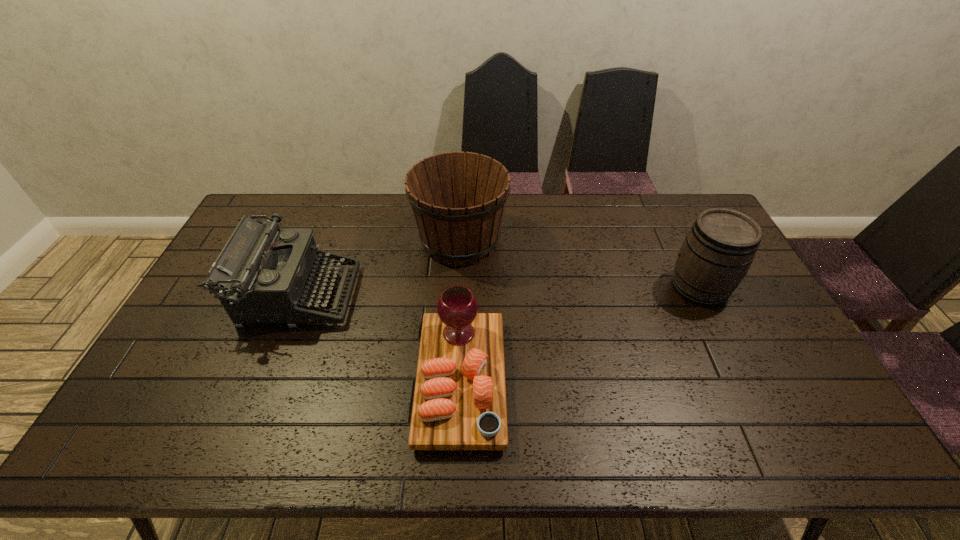
Find the location of a particular element. unoccupied area between the rightmost object and the leftmost object is located at coordinates (498, 292).

Locate an element on the screen. The image size is (960, 540). vacant area that lies between the rightmost object and the platter is located at coordinates (580, 334).

Locate an element on the screen. The image size is (960, 540). free area in between the typewriter and the left wine bucket is located at coordinates (379, 268).

Locate which object is the third closest to the platter. Please provide its 2D coordinates. Your answer should be formatted as a tuple, i.e. [(x, y)], where the tuple contains the x and y coordinates of a point satisfying the conditions above.

[(720, 247)]

Where is `object that stands as the third closest to the typewriter`? This screenshot has width=960, height=540. object that stands as the third closest to the typewriter is located at coordinates point(720,247).

Find the location of a particular element. This screenshot has width=960, height=540. vacant point that satisfies the following two spatial constraints: 1. on the front side of the rightmost object; 2. on the typing side of the typewriter is located at coordinates (703, 295).

At what (x,y) coordinates should I click in order to perform the action: click on free location that satisfies the following two spatial constraints: 1. on the typing side of the leftmost object; 2. on the right side of the platter. Please return your answer as a coordinate pair (x, y). This screenshot has width=960, height=540. Looking at the image, I should click on (264, 381).

The image size is (960, 540). I want to click on vacant position in the image that satisfies the following two spatial constraints: 1. on the back side of the platter; 2. on the typing side of the typewriter, so click(x=465, y=295).

The image size is (960, 540). Find the location of `free space that satisfies the following two spatial constraints: 1. on the typing side of the platter; 2. on the left side of the typewriter`. free space that satisfies the following two spatial constraints: 1. on the typing side of the platter; 2. on the left side of the typewriter is located at coordinates (264, 381).

Identify the location of vacant space that satisfies the following two spatial constraints: 1. on the front side of the platter; 2. on the left side of the left wine bucket. The image size is (960, 540). (453, 381).